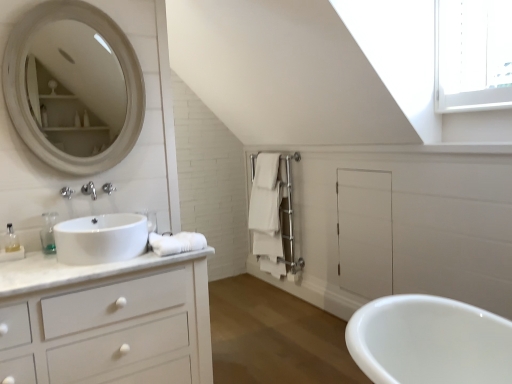
This screenshot has height=384, width=512. In order to click on free location in front of translucent plastic bottle at left, which is the 2th toiletry from left to right in this screenshot , I will do `click(36, 261)`.